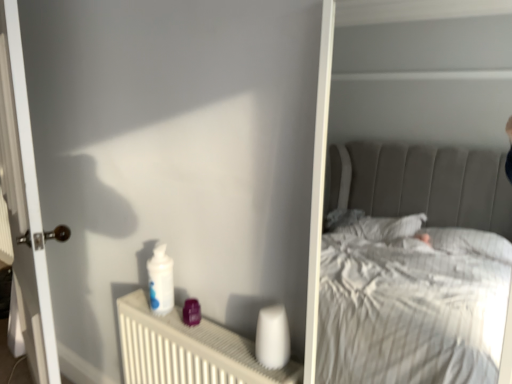
This screenshot has width=512, height=384. What do you see at coordinates (24, 205) in the screenshot? I see `white glossy door at left` at bounding box center [24, 205].

Locate an element on the screen. This screenshot has width=512, height=384. white glossy door at left is located at coordinates (24, 205).

Identify the location of white plastic radiator at lower center. This screenshot has height=384, width=512. (187, 350).

Describe the element at coordinates (187, 350) in the screenshot. The image size is (512, 384). I see `white plastic radiator at lower center` at that location.

Where is `white glossy door at left`? white glossy door at left is located at coordinates (24, 205).

In the image, is white plastic radiator at lower center on the left side or the right side of white glossy door at left?

white plastic radiator at lower center is to the right of white glossy door at left.

Considering the positions of objects white plastic radiator at lower center and white glossy door at left in the image provided, who is in front, white plastic radiator at lower center or white glossy door at left?

white plastic radiator at lower center is closer to the camera.

Considering the positions of point (215, 379) and point (33, 156), is point (215, 379) closer or farther from the camera than point (33, 156)?

Point (215, 379) is closer to the camera than point (33, 156).

Looking at this image, from the image's perspective, which one is positioned lower, white plastic radiator at lower center or white glossy door at left?

white plastic radiator at lower center, from the image's perspective.

From a real-world perspective, is white plastic radiator at lower center positioned under white glossy door at left based on gravity?

Yes, from a real-world perspective, white plastic radiator at lower center is below white glossy door at left.

Which object is wider, white plastic radiator at lower center or white glossy door at left?

With larger width is white glossy door at left.

Considering the relative sizes of white plastic radiator at lower center and white glossy door at left in the image provided, is white plastic radiator at lower center shorter than white glossy door at left?

Correct, white plastic radiator at lower center is not as tall as white glossy door at left.

Is white plastic radiator at lower center bigger than white glossy door at left?

No, white plastic radiator at lower center is not bigger than white glossy door at left.

Is white glossy door at left surrounded by white plastic radiator at lower center?

No, white glossy door at left is not inside white plastic radiator at lower center.

Is white plastic radiator at lower center next to white glossy door at left and touching it?

No, white plastic radiator at lower center is not making contact with white glossy door at left.

Is white plastic radiator at lower center oriented away from white glossy door at left?

white plastic radiator at lower center does not have its back to white glossy door at left.

From the picture: How much distance is there between white plastic radiator at lower center and white glossy door at left?

The distance of white plastic radiator at lower center from white glossy door at left is 52.93 centimeters.

Find the location of a particular element. This screenshot has height=384, width=512. door located behind the white plastic radiator at lower center is located at coordinates (24, 205).

Is white glossy door at left to the right of white plastic radiator at lower center from the viewer's perspective?

No.

Which is behind, white glossy door at left or white plastic radiator at lower center?

white glossy door at left is further away from the camera.

Which point is more forward, (9, 209) or (145, 342)?

The point (145, 342) is closer.

From the image's perspective, is white glossy door at left located above white plastic radiator at lower center?

Yes.

In the scene shown: From a real-world perspective, is white glossy door at left positioned under white plastic radiator at lower center based on gravity?

No, from a real-world perspective, white glossy door at left is not below white plastic radiator at lower center.

Considering the sizes of objects white glossy door at left and white plastic radiator at lower center in the image provided, who is thinner, white glossy door at left or white plastic radiator at lower center?

With smaller width is white plastic radiator at lower center.

Is white glossy door at left taller or shorter than white plastic radiator at lower center?

Clearly, white glossy door at left is taller compared to white plastic radiator at lower center.

Which of these two, white glossy door at left or white plastic radiator at lower center, is bigger?

With larger size is white glossy door at left.

Is white glossy door at left completely or partially outside of white plastic radiator at lower center?

Absolutely, white glossy door at left is external to white plastic radiator at lower center.

Is white glossy door at left with white plastic radiator at lower center?

white glossy door at left and white plastic radiator at lower center are not in contact.

Is white glossy door at left facing away from white plastic radiator at lower center?

white glossy door at left does not have its back to white plastic radiator at lower center.

How many degrees apart are the facing directions of white glossy door at left and white plastic radiator at lower center?

They differ by 14.8 degrees in their facing directions.

How much distance is there between white glossy door at left and white plastic radiator at lower center?

white glossy door at left is 20.84 inches away from white plastic radiator at lower center.

Locate an element on the screen. Image resolution: width=512 pixels, height=384 pixels. radiator below the white glossy door at left (from a real-world perspective) is located at coordinates (187, 350).

Locate an element on the screen. Image resolution: width=512 pixels, height=384 pixels. radiator in front of the white glossy door at left is located at coordinates (187, 350).

What are the coordinates of `door on the left of the white plastic radiator at lower center` in the screenshot? It's located at (24, 205).